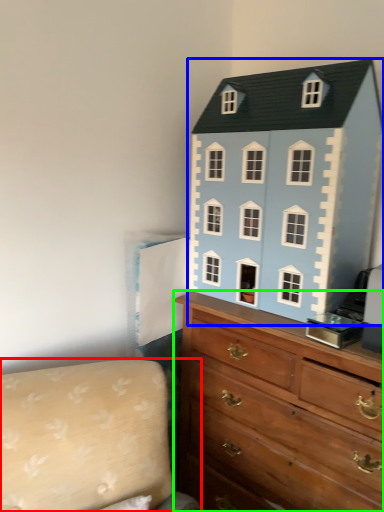
Question: Which is nearer to the couch (highlighted by a red box)? toy (highlighted by a blue box) or chest of drawers (highlighted by a green box).

Choices:
 (A) toy
 (B) chest of drawers

Answer: (B)